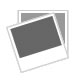
This screenshot has width=80, height=80. What are the coordinates of `bottom border of picture` in the screenshot? It's located at (38, 60), (65, 46).